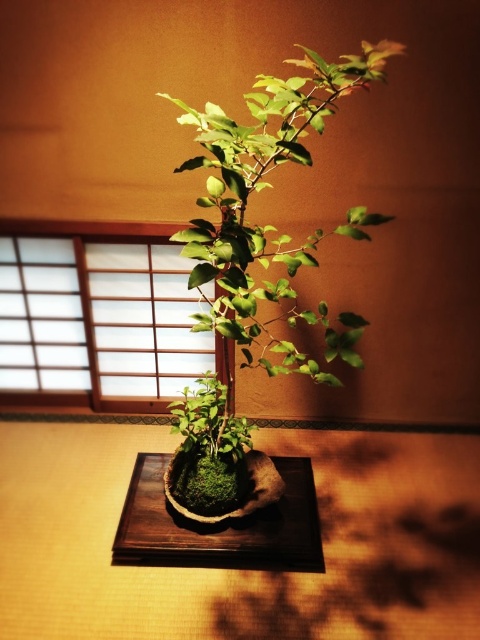
Question: In this image, where is green mossy pot at center located relative to dark brown wooden tray at center?

Choices:
 (A) above
 (B) below

Answer: (A)

Question: Among these points, which one is nearest to the camera?

Choices:
 (A) (224, 440)
 (B) (146, 557)

Answer: (A)

Question: Which point is closer to the camera?

Choices:
 (A) green mossy pot at center
 (B) dark brown wooden tray at center

Answer: (A)

Question: Which point is closer to the camera?

Choices:
 (A) dark brown wooden tray at center
 (B) green mossy pot at center

Answer: (B)

Question: Can you confirm if green mossy pot at center is thinner than dark brown wooden tray at center?

Choices:
 (A) no
 (B) yes

Answer: (A)

Question: Is green mossy pot at center further to the viewer compared to dark brown wooden tray at center?

Choices:
 (A) no
 (B) yes

Answer: (A)